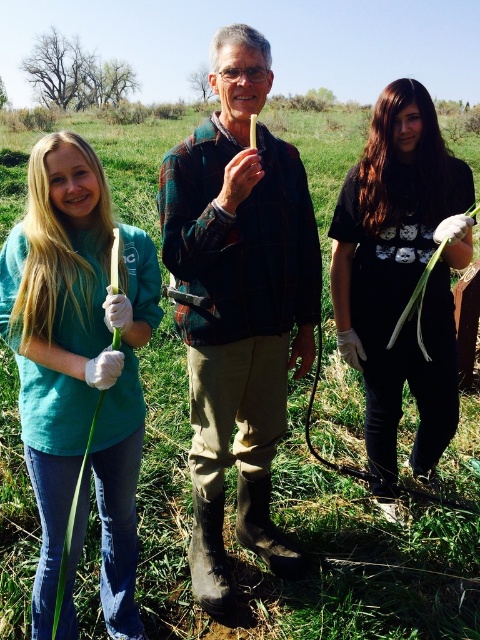
Question: Which point is closer to the camera?

Choices:
 (A) green matte/gloved hand holding plant at left
 (B) green matte plant at center
 (C) black cotton shirt at right

Answer: (A)

Question: Based on their relative distances, which object is nearer to the green matte plant at center?

Choices:
 (A) black cotton shirt at right
 (B) green matte/gloved hand holding plant at left

Answer: (B)

Question: Is the position of green matte plant at center more distant than that of black cotton shirt at right?

Choices:
 (A) yes
 (B) no

Answer: (B)

Question: Does green matte/gloved hand holding plant at left lie behind black cotton shirt at right?

Choices:
 (A) no
 (B) yes

Answer: (A)

Question: Among these objects, which one is farthest from the camera?

Choices:
 (A) green matte plant at center
 (B) black cotton shirt at right

Answer: (B)

Question: Does green matte plant at center appear under green matte/gloved hand holding plant at left?

Choices:
 (A) yes
 (B) no

Answer: (B)